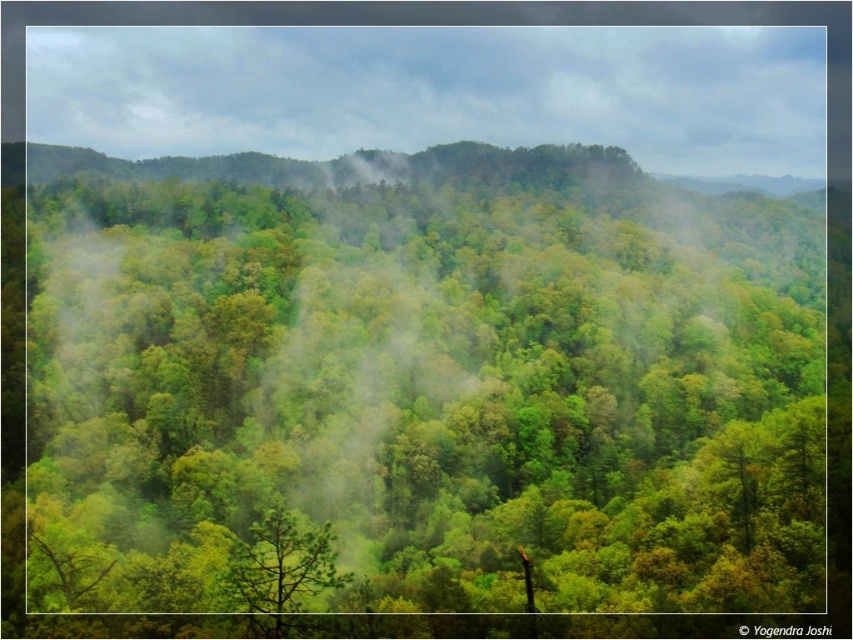
Does point (503, 522) lie in front of point (251, 541)?

Yes, point (503, 522) is closer to viewer.

Between point (776, 596) and point (279, 552), which one is positioned in front?

Point (279, 552) is in front.

Identify the location of green leafy tree at center. tap(415, 388).

Is green leafy tree at center shorter than green misty forest at upper center?

Yes, green leafy tree at center is shorter than green misty forest at upper center.

Between point (137, 372) and point (141, 26), which one is positioned behind?

The point (141, 26) is more distant.

Who is more distant from viewer, [190,285] or [102,42]?

The point [102,42] is more distant.

The height and width of the screenshot is (640, 853). Find the location of `green leafy tree at center`. green leafy tree at center is located at coordinates (415, 388).

Based on the photo, is green misty forest at upper center to the left of green matte tree at center from the viewer's perspective?

In fact, green misty forest at upper center is to the right of green matte tree at center.

In the scene shown: Is green misty forest at upper center shorter than green matte tree at center?

In fact, green misty forest at upper center may be taller than green matte tree at center.

Locate an element on the screen. green misty forest at upper center is located at coordinates (438, 92).